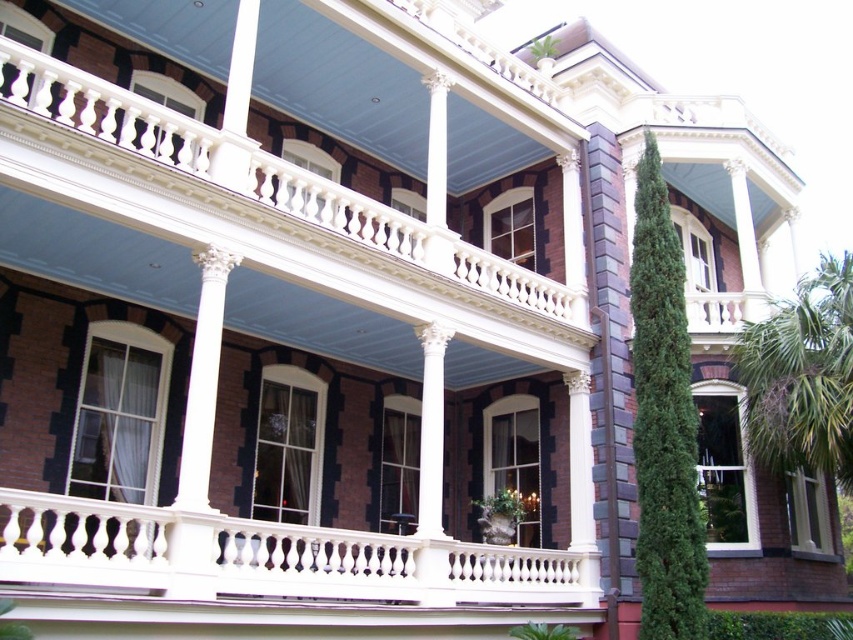
Where is `green textured cypress tree at right`? The image size is (853, 640). green textured cypress tree at right is located at coordinates (663, 420).

Who is positioned more to the left, green textured cypress tree at right or white marble column at center?

From the viewer's perspective, white marble column at center appears more on the left side.

Which is in front, point (672, 544) or point (189, 531)?

Point (189, 531)

Image resolution: width=853 pixels, height=640 pixels. What are the coordinates of `green textured cypress tree at right` in the screenshot? It's located at (663, 420).

Between green leafy palm at right and white marble column at center, which one has more height?

Standing taller between the two is green leafy palm at right.

Can you confirm if green leafy palm at right is bigger than white marble column at center?

Yes, green leafy palm at right is bigger than white marble column at center.

Locate an element on the screen. The height and width of the screenshot is (640, 853). green leafy palm at right is located at coordinates (802, 376).

Which is below, green textured cypress tree at right or green leafy palm at right?

green textured cypress tree at right is lower down.

Locate an element on the screen. The width and height of the screenshot is (853, 640). green textured cypress tree at right is located at coordinates [x=663, y=420].